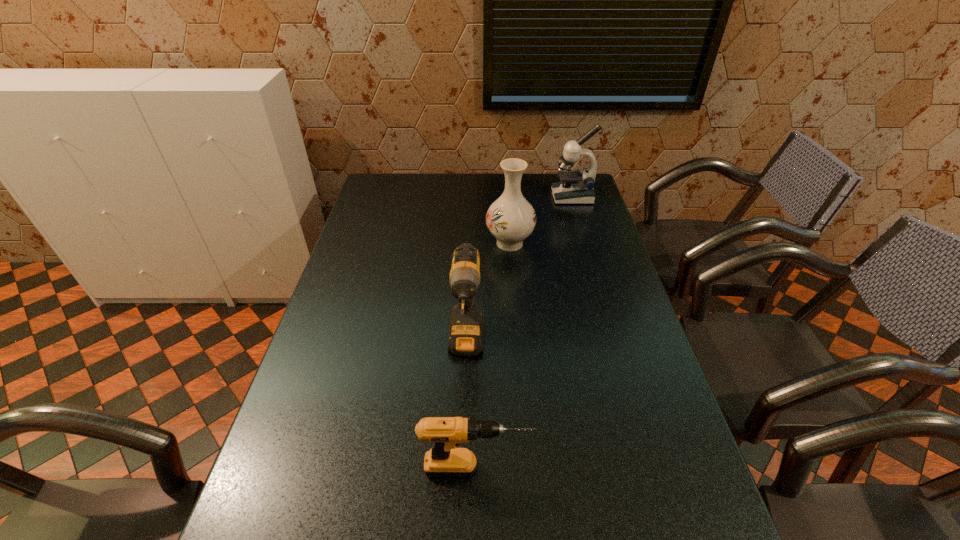
Locate an element on the screen. the farthest object is located at coordinates (577, 187).

Where is `microscope`? microscope is located at coordinates (577, 187).

The width and height of the screenshot is (960, 540). What are the coordinates of `vase` in the screenshot? It's located at (511, 218).

Where is `the taller drill`? The height and width of the screenshot is (540, 960). the taller drill is located at coordinates (466, 328).

Find the location of a particular element. The image size is (960, 540). the farther drill is located at coordinates coord(466,328).

Find the location of `the shorter drill`. the shorter drill is located at coordinates (444, 459).

Where is `the shortest object`? the shortest object is located at coordinates (444, 459).

Identify the location of vacant region located at the eyepiece of the rightmost object. (462, 197).

Image resolution: width=960 pixels, height=540 pixels. Identify the location of vacant area situated at the eyepiece of the rightmost object. (509, 197).

Identify the location of vacant area situated 0.170m at the eyepiece of the rightmost object. The height and width of the screenshot is (540, 960). (511, 197).